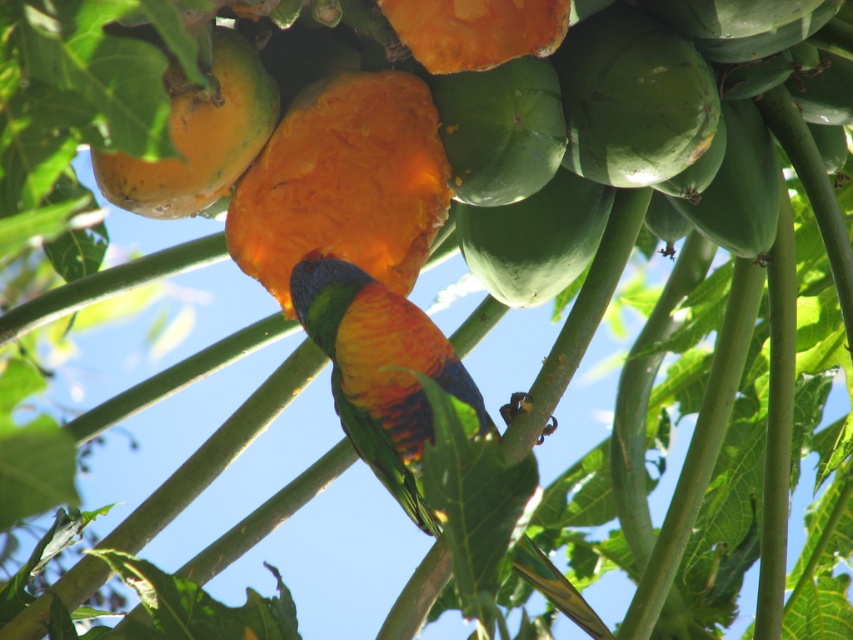
Question: Does orange matte papaya at center have a greater width compared to rainbow feathered parrot at center?

Choices:
 (A) no
 (B) yes

Answer: (A)

Question: Which object is positioned farthest from the orange papaya at center?

Choices:
 (A) orange matte papaya at center
 (B) ripe papaya at center

Answer: (B)

Question: Which point is farther to the camera?

Choices:
 (A) (416, 342)
 (B) (251, 212)
 (C) (293, 218)

Answer: (C)

Question: Can you confirm if orange papaya at center is smaller than orange matte papaya at center?

Choices:
 (A) yes
 (B) no

Answer: (B)

Question: Which point appears closest to the camera in this image?

Choices:
 (A) (482, 214)
 (B) (286, 148)

Answer: (B)

Question: Is orange matte papaya at center positioned before rainbow feathered parrot at center?

Choices:
 (A) yes
 (B) no

Answer: (B)